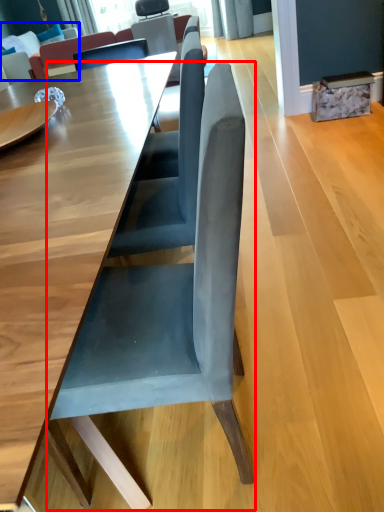
Question: Which point is further to the camera, chair (highlighted by a red box) or couch (highlighted by a blue box)?

Choices:
 (A) chair
 (B) couch

Answer: (B)